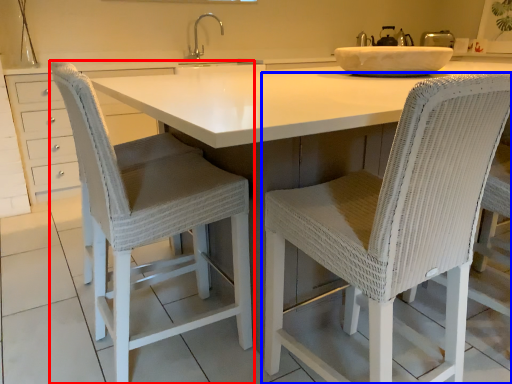
Question: Which object appears closest to the camera in this image, chair (highlighted by a red box) or chair (highlighted by a blue box)?

Choices:
 (A) chair
 (B) chair

Answer: (B)